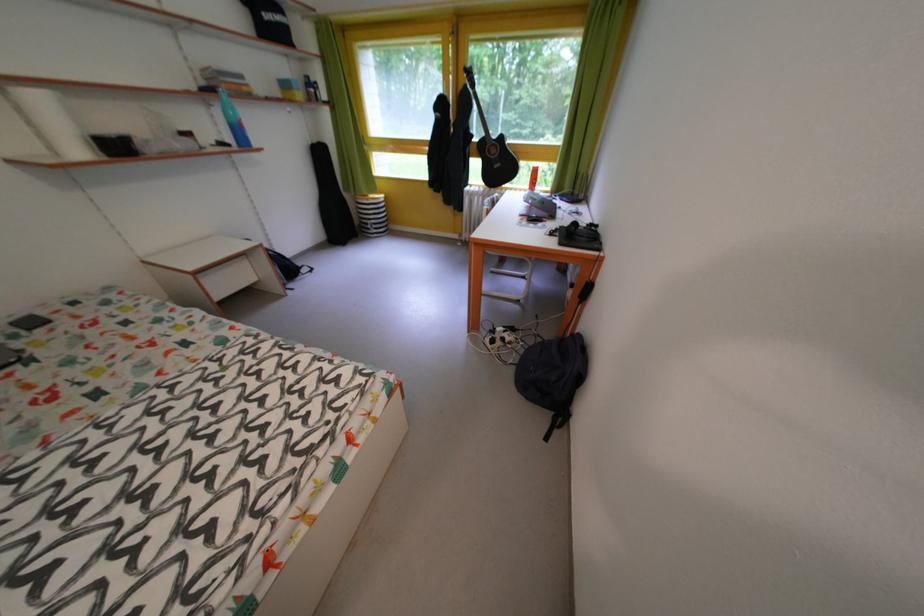
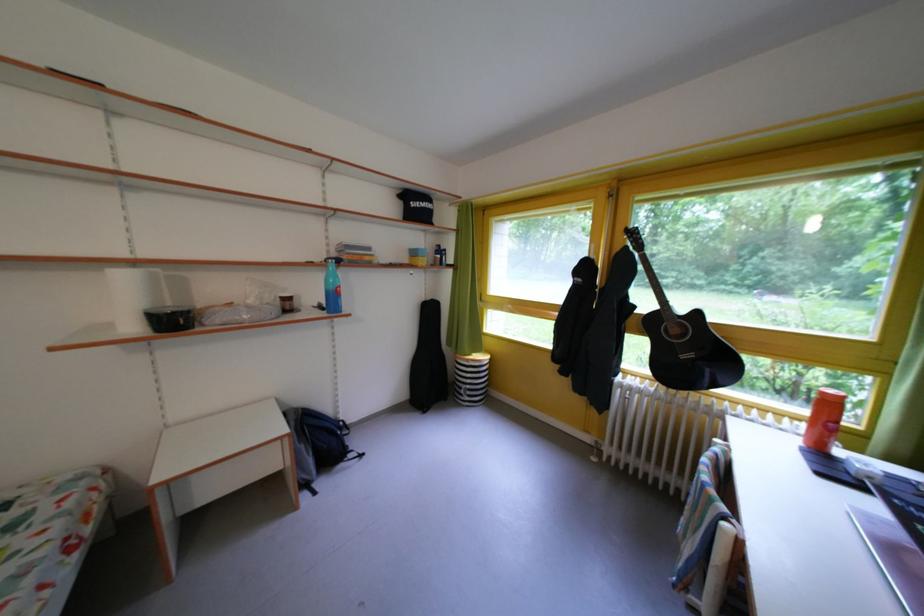
In the second image, find the point that corresponds to pixel 232 150 in the first image.

(331, 313)